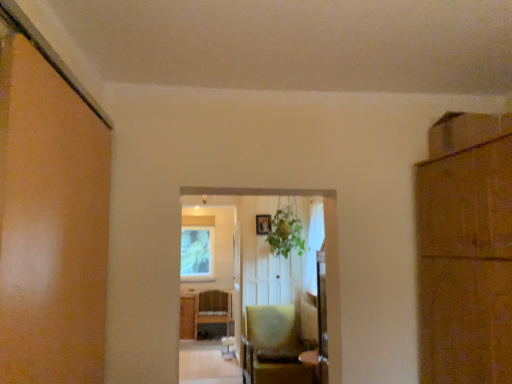
Question: From the image's perspective, is green leafy plant at center on matte yellow chair at center?

Choices:
 (A) no
 (B) yes

Answer: (B)

Question: Is green leafy plant at center positioned with its back to matte yellow chair at center?

Choices:
 (A) no
 (B) yes

Answer: (A)

Question: Is green leafy plant at center closer to camera compared to matte yellow chair at center?

Choices:
 (A) no
 (B) yes

Answer: (A)

Question: Is green leafy plant at center to the right of matte yellow chair at center from the viewer's perspective?

Choices:
 (A) no
 (B) yes

Answer: (B)

Question: Are green leafy plant at center and matte yellow chair at center located far from each other?

Choices:
 (A) yes
 (B) no

Answer: (A)

Question: Is green leafy plant at center next to matte yellow chair at center and touching it?

Choices:
 (A) yes
 (B) no

Answer: (B)

Question: Does brown cardboard cabinet at right have a lesser width compared to matte yellow chair at center?

Choices:
 (A) yes
 (B) no

Answer: (A)

Question: From a real-world perspective, does brown cardboard cabinet at right stand above matte yellow chair at center?

Choices:
 (A) yes
 (B) no

Answer: (A)

Question: Considering the relative sizes of brown cardboard cabinet at right and matte yellow chair at center in the image provided, is brown cardboard cabinet at right smaller than matte yellow chair at center?

Choices:
 (A) no
 (B) yes

Answer: (B)

Question: From the image's perspective, is brown cardboard cabinet at right on top of matte yellow chair at center?

Choices:
 (A) no
 (B) yes

Answer: (B)

Question: Is the depth of brown cardboard cabinet at right greater than that of matte yellow chair at center?

Choices:
 (A) no
 (B) yes

Answer: (A)

Question: From the image's perspective, would you say brown cardboard cabinet at right is shown under matte yellow chair at center?

Choices:
 (A) yes
 (B) no

Answer: (B)

Question: Is matte yellow chair at center shorter than brown cardboard cabinet at right?

Choices:
 (A) yes
 (B) no

Answer: (A)